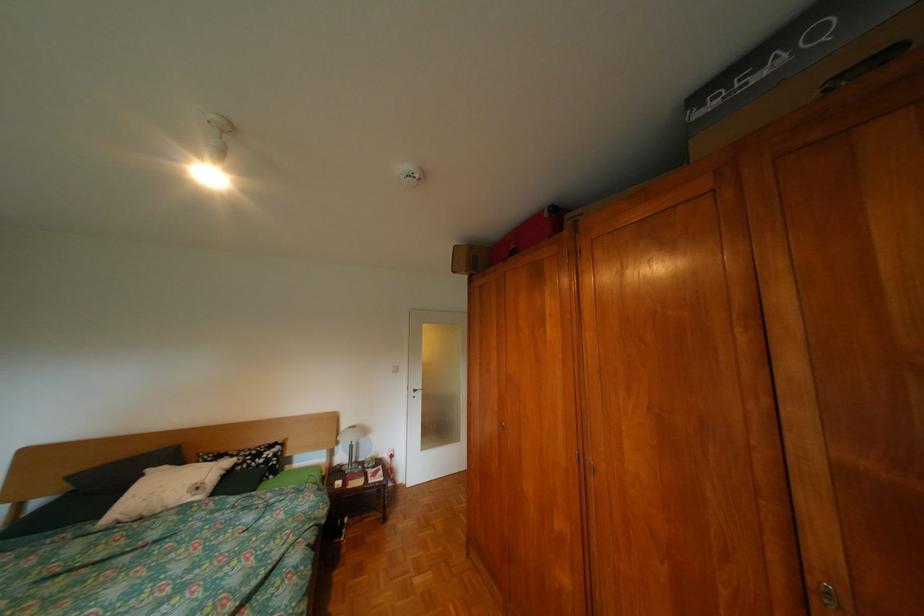
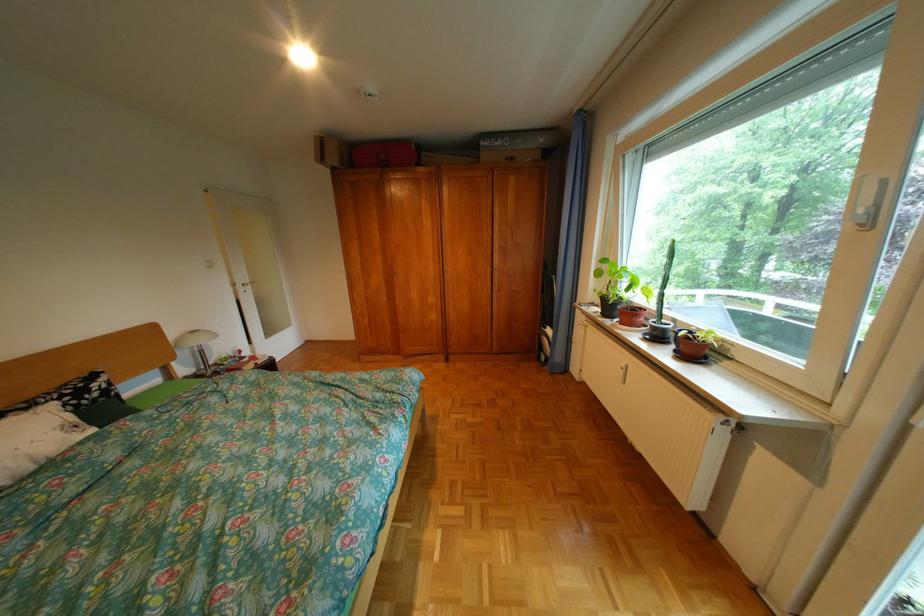
Where in the second image is the point corresponding to point 581,217 from the first image?

(438, 154)